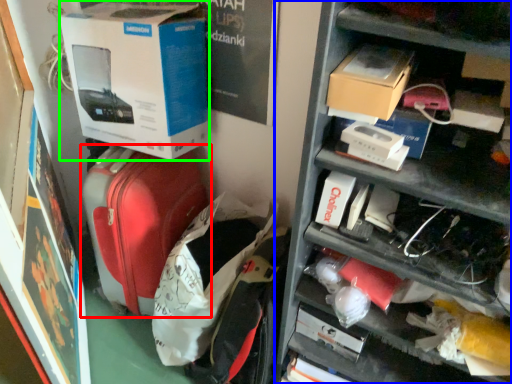
Question: Considering the real-world distances, which object is farthest from suitcase (highlighted by a red box)? shelf (highlighted by a blue box) or box (highlighted by a green box)?

Choices:
 (A) shelf
 (B) box

Answer: (A)